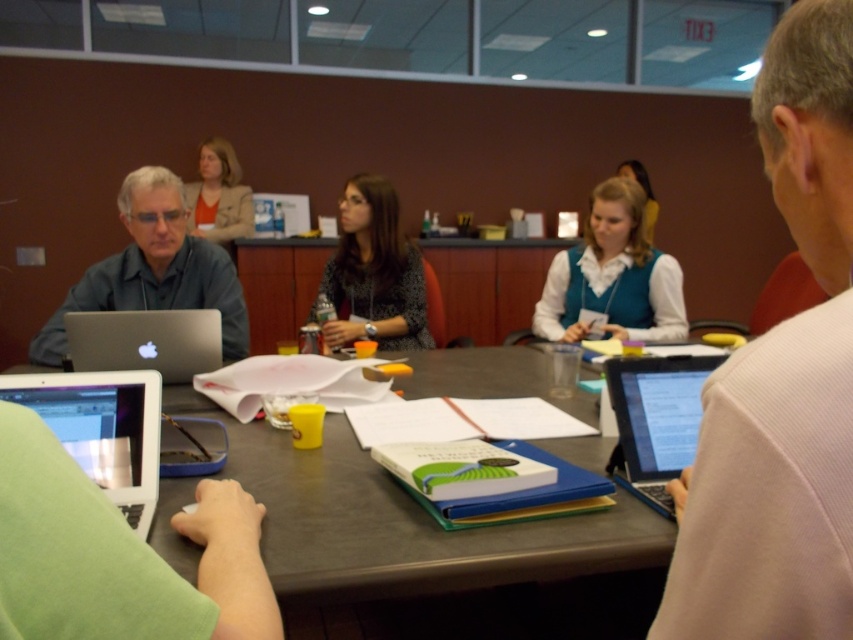
You are a participant in the meeting and need to place a document on the table. The document must be placed exactly at the coordinates given in the Objects Description. Where should you place it relative to the matte black laptop at left?

The document should be placed at the coordinates specified in the Objects Description, which is at point (154, 269) relative to the matte black laptop at left.

You are a participant in the meeting and need to place a 10 cm tall notebook on the table. Considering the white matte vest at center and the silver metallic laptop at right, which object can the notebook be placed on top of without exceeding its height?

The notebook can be placed on top of the white matte vest at center because it has a greater height compared to the silver metallic laptop at right, allowing the notebook to fit without exceeding its height.